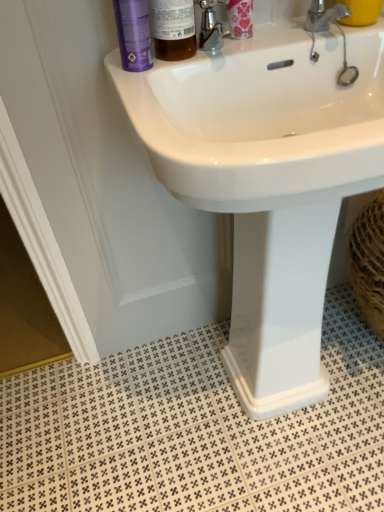
Question: Should I look upward or downward to see white glossy sink at upper center?

Choices:
 (A) up
 (B) down

Answer: (B)

Question: Would you say white glossy sink at upper center is a long distance from floral-patterned plastic container at upper center?

Choices:
 (A) yes
 (B) no

Answer: (B)

Question: Is white glossy sink at upper center turned away from floral-patterned plastic container at upper center?

Choices:
 (A) yes
 (B) no

Answer: (B)

Question: Does white glossy sink at upper center have a smaller size compared to floral-patterned plastic container at upper center?

Choices:
 (A) yes
 (B) no

Answer: (B)

Question: Is white glossy sink at upper center directly adjacent to floral-patterned plastic container at upper center?

Choices:
 (A) yes
 (B) no

Answer: (B)

Question: Is white glossy sink at upper center closer to camera compared to floral-patterned plastic container at upper center?

Choices:
 (A) yes
 (B) no

Answer: (A)

Question: Does white glossy sink at upper center appear on the left side of floral-patterned plastic container at upper center?

Choices:
 (A) no
 (B) yes

Answer: (A)

Question: Is translucent amber bottle at upper center inside floral-patterned plastic container at upper center?

Choices:
 (A) no
 (B) yes

Answer: (A)

Question: Is floral-patterned plastic container at upper center taller than translucent amber bottle at upper center?

Choices:
 (A) yes
 (B) no

Answer: (A)

Question: Can you confirm if floral-patterned plastic container at upper center is smaller than translucent amber bottle at upper center?

Choices:
 (A) yes
 (B) no

Answer: (A)

Question: From a real-world perspective, is floral-patterned plastic container at upper center beneath translucent amber bottle at upper center?

Choices:
 (A) yes
 (B) no

Answer: (B)

Question: Does floral-patterned plastic container at upper center appear on the left side of translucent amber bottle at upper center?

Choices:
 (A) no
 (B) yes

Answer: (A)

Question: Is floral-patterned plastic container at upper center not near translucent amber bottle at upper center?

Choices:
 (A) no
 (B) yes

Answer: (A)

Question: Does yellow matte cup at upper right have a smaller size compared to white glossy sink at upper center?

Choices:
 (A) no
 (B) yes

Answer: (B)